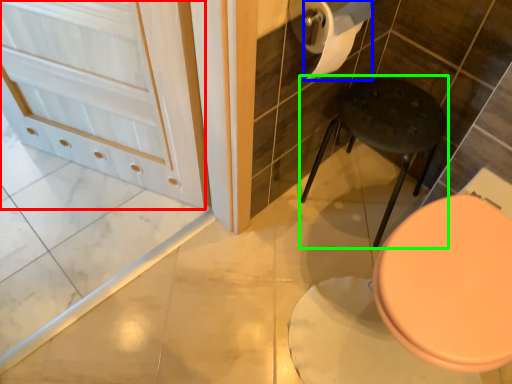
Question: Considering the real-world distances, which object is closest to screen door (highlighted by a red box)? toilet paper (highlighted by a blue box) or bar stool (highlighted by a green box).

Choices:
 (A) toilet paper
 (B) bar stool

Answer: (A)